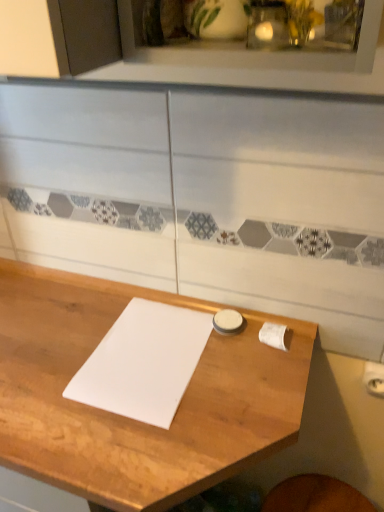
In order to click on vacant space to the left of white matte journal at center in this screenshot , I will do `click(49, 349)`.